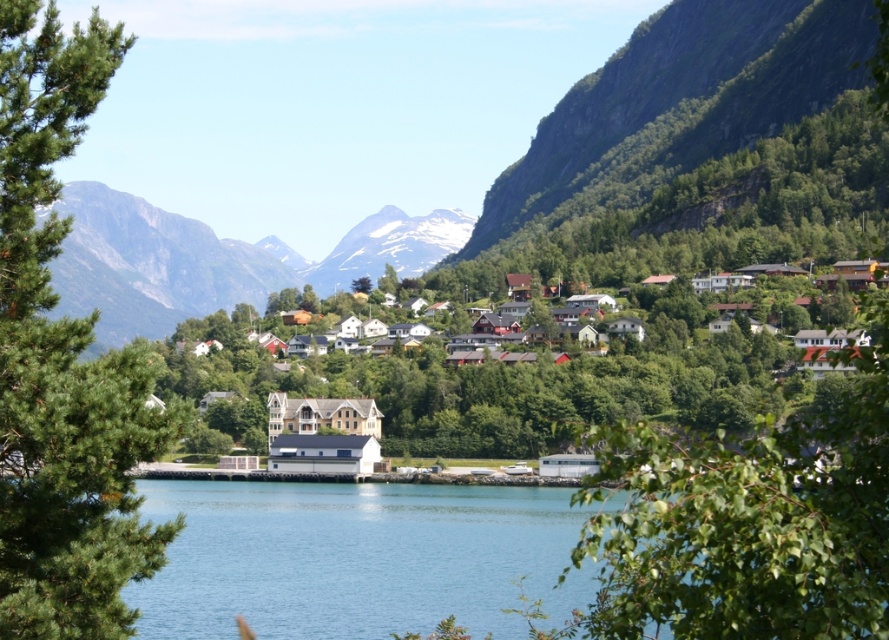
Is green leafy tree at left to the right of white wooden houses at center from the viewer's perspective?

No, green leafy tree at left is not to the right of white wooden houses at center.

Based on the photo, does green leafy tree at left appear on the left side of white wooden houses at center?

Indeed, green leafy tree at left is positioned on the left side of white wooden houses at center.

Who is more distant from viewer, (23,49) or (675,392)?

Point (675,392)

Where is `green leafy tree at left`? green leafy tree at left is located at coordinates (63, 364).

Based on the photo, does green rocky mountain at upper right have a greater width compared to snowy rock mountain at center?

Yes.

Between green rocky mountain at upper right and snowy rock mountain at center, which one is positioned lower?

snowy rock mountain at center is lower down.

The width and height of the screenshot is (889, 640). Describe the element at coordinates (677, 104) in the screenshot. I see `green rocky mountain at upper right` at that location.

Where is `green rocky mountain at upper right`? Image resolution: width=889 pixels, height=640 pixels. green rocky mountain at upper right is located at coordinates (677, 104).

Between point (71, 42) and point (194, 276), which one is positioned behind?

The point (194, 276) is more distant.

Locate an element on the screen. Image resolution: width=889 pixels, height=640 pixels. green leafy tree at left is located at coordinates (63, 364).

Is point (86, 632) less distant than point (223, 248)?

Yes, it is.

Identify the location of green leafy tree at left. The height and width of the screenshot is (640, 889). (63, 364).